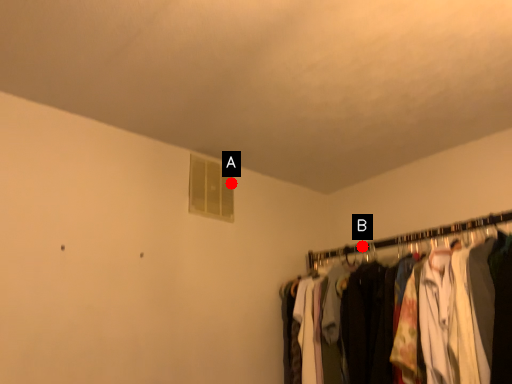
Question: Two points are circled on the image, labeled by A and B beside each circle. Which point appears farthest from the camera in this image?

Choices:
 (A) A is further
 (B) B is further

Answer: (A)